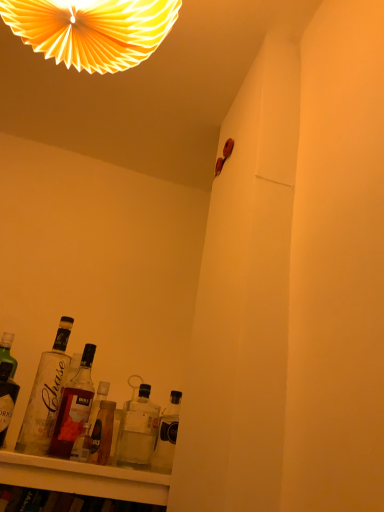
Question: From their relative heights in the image, would you say translucent glass bottle at lower center, arranged as the 4th bottle when viewed from the left, is taller or shorter than clear glass bottle at lower left, positioned as the 4th bottle in right-to-left order?

Choices:
 (A) short
 (B) tall

Answer: (A)

Question: Considering the positions of translucent glass bottle at lower center, the 2th bottle when ordered from right to left, and clear glass bottle at lower left, positioned as the 4th bottle in right-to-left order, in the image, is translucent glass bottle at lower center, the 2th bottle when ordered from right to left, wider or thinner than clear glass bottle at lower left, positioned as the 4th bottle in right-to-left order,?

Choices:
 (A) wide
 (B) thin

Answer: (A)

Question: Which object is the farthest from the clear glass bottle at lower left, positioned as the 4th bottle in right-to-left order?

Choices:
 (A) clear glass bottle at lower left, marked as the 1th bottle in a left-to-right arrangement
 (B) yellow paper fan at upper center
 (C) translucent glass bottle at lower center, arranged as the 4th bottle when viewed from the left
 (D) translucent glass bottle at lower right, acting as the fifth bottle starting from the left
 (E) translucent glass bottle at lower left, which is counted as the 3th bottle, starting from the right

Answer: (B)

Question: Which object is positioned closest to the clear glass bottle at lower left, marked as the 1th bottle in a left-to-right arrangement?

Choices:
 (A) translucent glass bottle at lower center, the 2th bottle when ordered from right to left
 (B) clear glass bottle at lower left, positioned as the 4th bottle in right-to-left order
 (C) yellow paper fan at upper center
 (D) translucent glass bottle at lower right, marked as the 1th bottle in a right-to-left arrangement
 (E) translucent glass bottle at lower left, which is counted as the 3th bottle, starting from the right

Answer: (B)